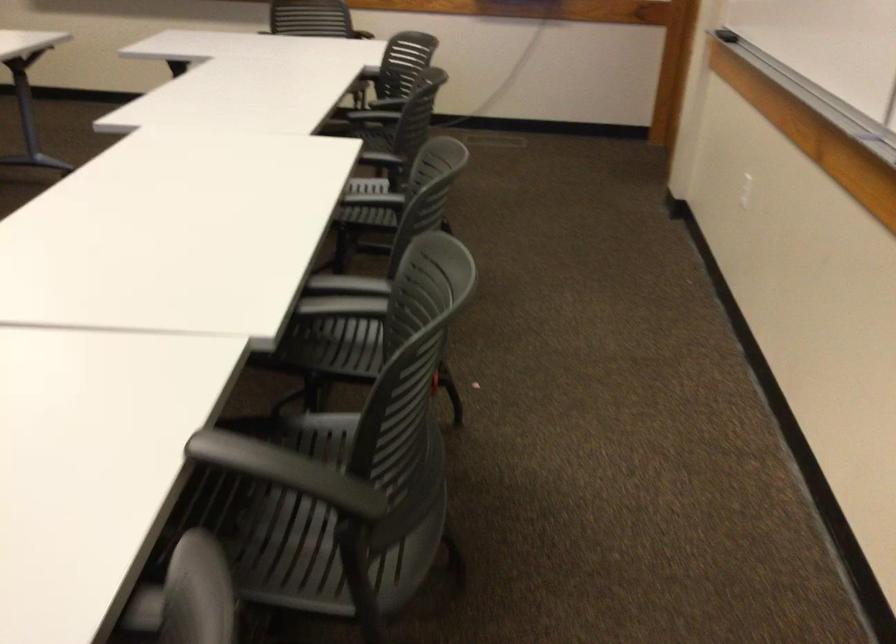
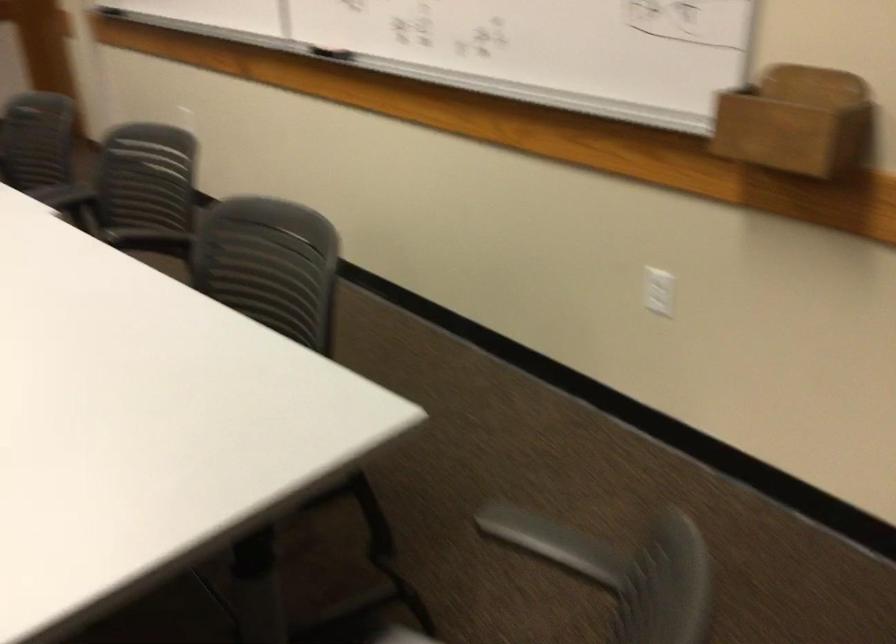
Find the pixel in the second image that matches point 418,310 in the first image.

(144, 178)